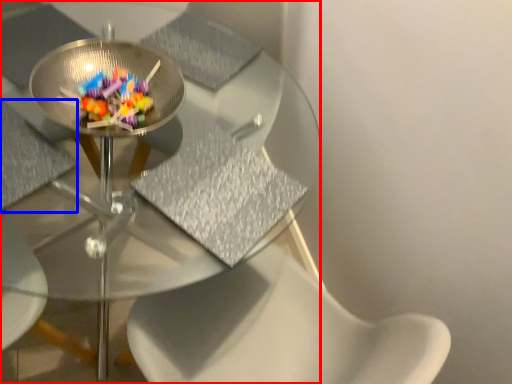
Question: Which object appears closest to the camera in this image, table (highlighted by a red box) or chair (highlighted by a blue box)?

Choices:
 (A) table
 (B) chair

Answer: (A)